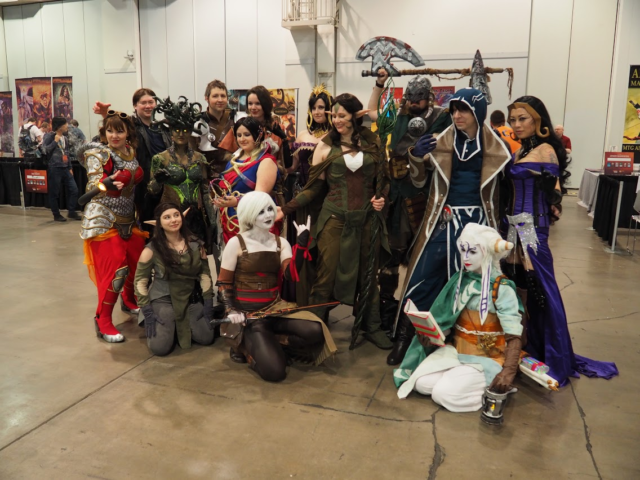
Find the location of `tablecloth`. tablecloth is located at coordinates (612, 187).